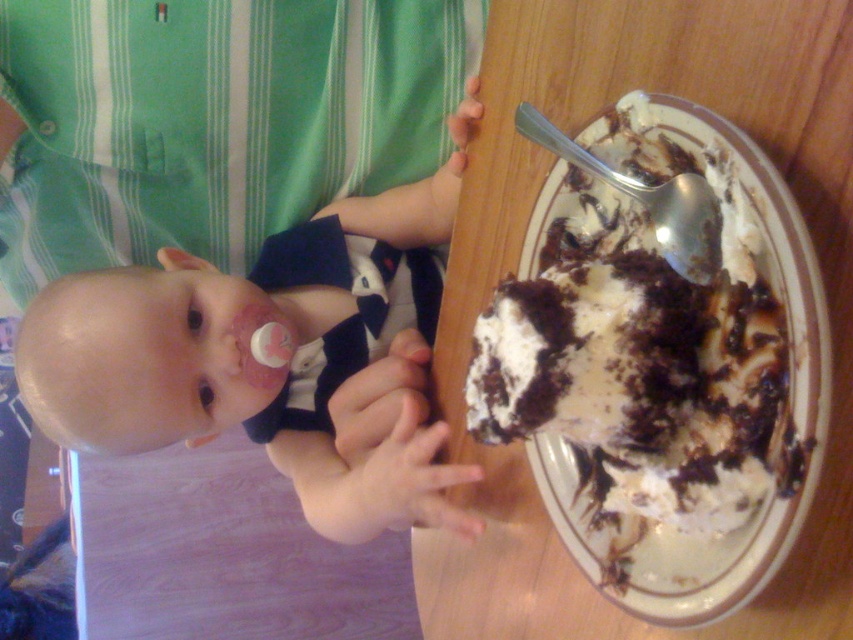
Question: Is pink pacifier at left thinner than white glazed porcelain at right?

Choices:
 (A) no
 (B) yes

Answer: (A)

Question: From the image, what is the correct spatial relationship of pink pacifier at left in relation to white glazed porcelain at right?

Choices:
 (A) right
 (B) left

Answer: (B)

Question: Which object appears farthest from the camera in this image?

Choices:
 (A) white glazed porcelain at right
 (B) pink pacifier at left

Answer: (B)

Question: Is pink pacifier at left to the right of white glazed porcelain at right from the viewer's perspective?

Choices:
 (A) no
 (B) yes

Answer: (A)

Question: Which of the following is the farthest from the observer?

Choices:
 (A) pink pacifier at left
 (B) white glazed porcelain at right

Answer: (A)